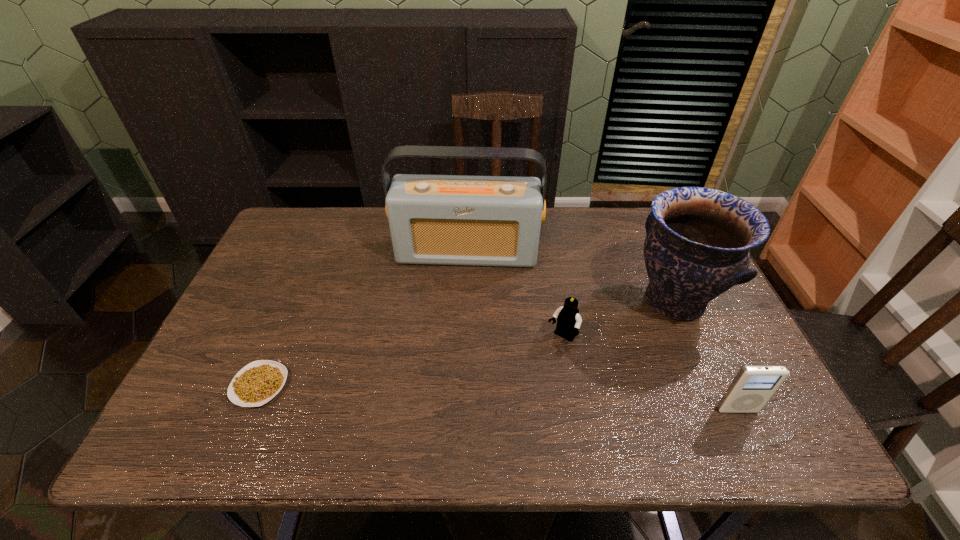
The width and height of the screenshot is (960, 540). In order to click on the shortest object in this screenshot , I will do pos(258,382).

The height and width of the screenshot is (540, 960). I want to click on the leftmost object, so click(258, 382).

You are a GUI agent. You are given a task and a screenshot of the screen. Output one action in this format:
    pyautogui.click(x=<x>, y=<y>)
    Task: Click on the iPod
    
    Given the screenshot: What is the action you would take?
    pyautogui.click(x=752, y=387)

This screenshot has height=540, width=960. In order to click on the tallest object in this screenshot , I will do `click(464, 220)`.

Locate an element on the screen. Lego is located at coordinates (569, 320).

Where is `pottery`? The height and width of the screenshot is (540, 960). pottery is located at coordinates (698, 240).

Image resolution: width=960 pixels, height=540 pixels. Find the location of `free space located on the back of the legume`. free space located on the back of the legume is located at coordinates (299, 294).

Locate an element on the screen. This screenshot has height=540, width=960. free region located 0.070m on the front-facing side of the tallest object is located at coordinates [462, 286].

Find the location of `free space located on the front-facing side of the tallest object`. free space located on the front-facing side of the tallest object is located at coordinates (453, 366).

Identify the location of vacant space situated 0.340m on the front-facing side of the tallest object. [453, 366].